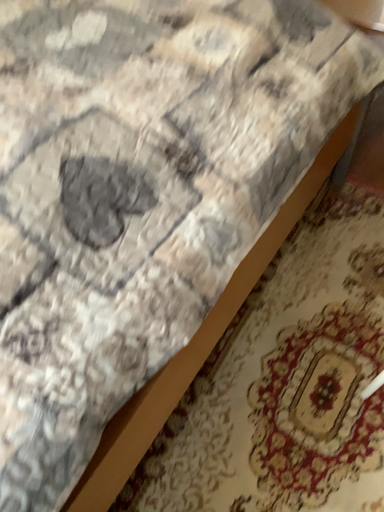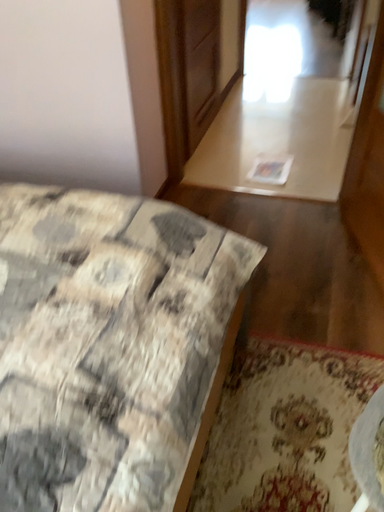
Question: How did the camera likely rotate when shooting the video?

Choices:
 (A) rotated downward
 (B) rotated upward

Answer: (B)